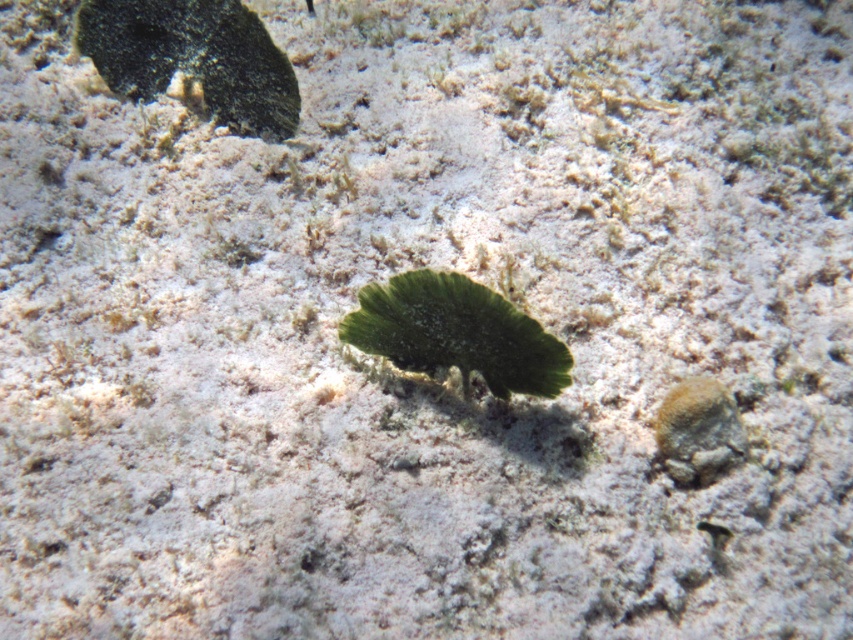
Question: Is green leafy algae at center to the right of rusty metallic rock at lower right from the viewer's perspective?

Choices:
 (A) no
 (B) yes

Answer: (A)

Question: Where is smooth dark green leaf at upper left located in relation to green leafy algae at center in the image?

Choices:
 (A) left
 (B) right

Answer: (A)

Question: Among these objects, which one is farthest from the camera?

Choices:
 (A) rusty metallic rock at lower right
 (B) green leafy algae at center
 (C) smooth dark green leaf at upper left

Answer: (C)

Question: In this image, where is smooth dark green leaf at upper left located relative to rusty metallic rock at lower right?

Choices:
 (A) above
 (B) below

Answer: (A)

Question: Which of the following is the farthest from the observer?

Choices:
 (A) green leafy algae at center
 (B) smooth dark green leaf at upper left
 (C) rusty metallic rock at lower right

Answer: (B)

Question: Based on their relative distances, which object is farther from the smooth dark green leaf at upper left?

Choices:
 (A) green leafy algae at center
 (B) rusty metallic rock at lower right

Answer: (B)